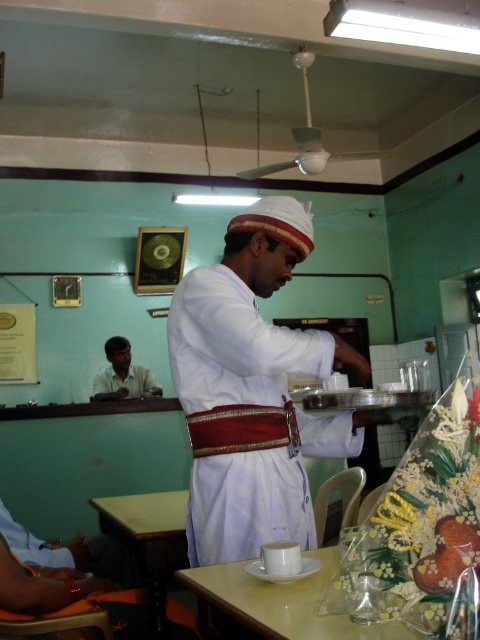
You are a customer in the cafe and want to place your phone on the white glossy table at lower center. However, you notice another customer has placed a large plate on the matte white shirt at lower left. Considering the size of the objects, which surface do you think can accommodate the phone more comfortably?

The white glossy table at lower center has a smaller size compared to the matte white shirt at lower left, so the matte white shirt at lower left would be more suitable for placing the phone comfortably.

Consider the image. You are a customer in the cafe and want to reach both the point at (x=230, y=484) and the point at (x=224, y=588). Which point should you approach first if you want to reach the one closer to you?

You should approach point (x=230, y=484) first because it is closer to you than point (x=224, y=588).